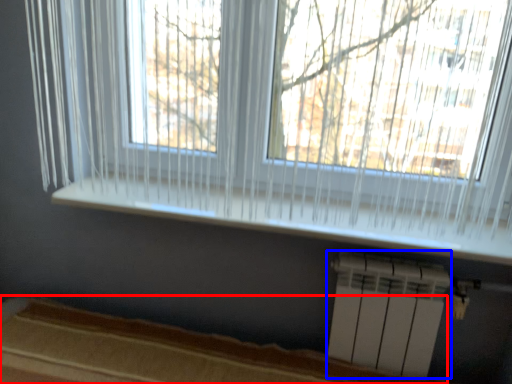
Question: Which object appears closest to the camera in this image, bed frame (highlighted by a red box) or air conditioning (highlighted by a blue box)?

Choices:
 (A) bed frame
 (B) air conditioning

Answer: (A)